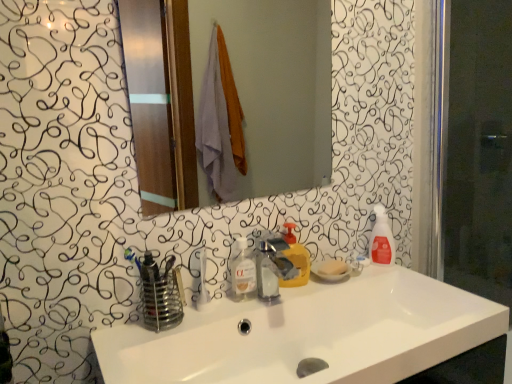
The height and width of the screenshot is (384, 512). I want to click on free spot in front of yellow liquid soap at center, the 2th cleaning product when ordered from back to front, so click(278, 300).